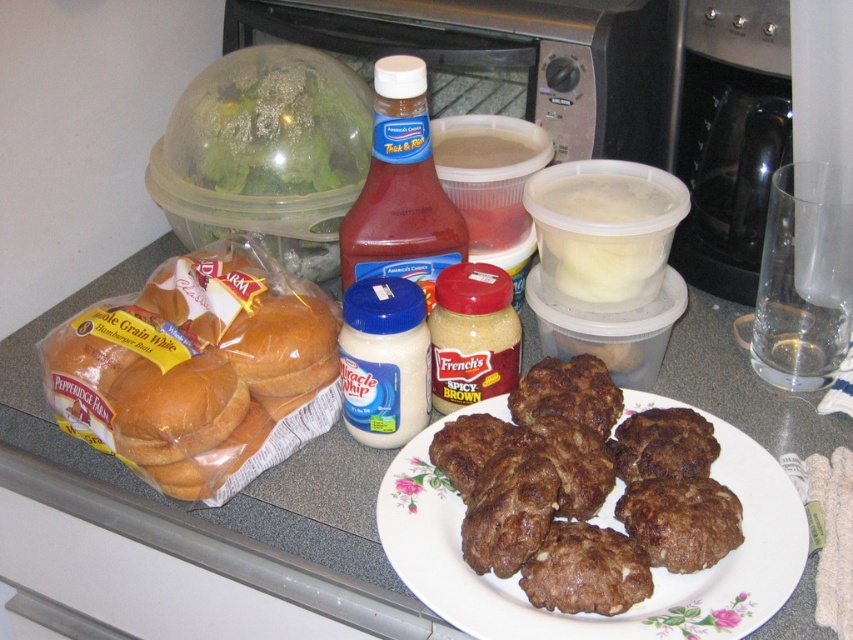
You are a chef trying to place a new patty exactly at the center of the kitchen countertop. The current brown crispy patty at center is already placed at point 0.767, 0.687. What should you do to position the new patty correctly?

The new patty should be placed at the center point of the kitchen countertop, which is different from the current position of the brown crispy patty at center located at (585, 490). Move the new patty to the true center coordinates.

You are a chef preparing a burger and need to place the brown crispy patty at center and the red glass bottle at center on a shelf. The shelf has a height limit of 10 cm. Can both items fit vertically without exceeding the height limit?

The brown crispy patty at center is not as tall as the red glass bottle at center. Since the shelf has a height limit of 10 cm, both items can fit vertically if the tallest item, the red glass bottle at center, is under 10 cm. However, the exact heights aren